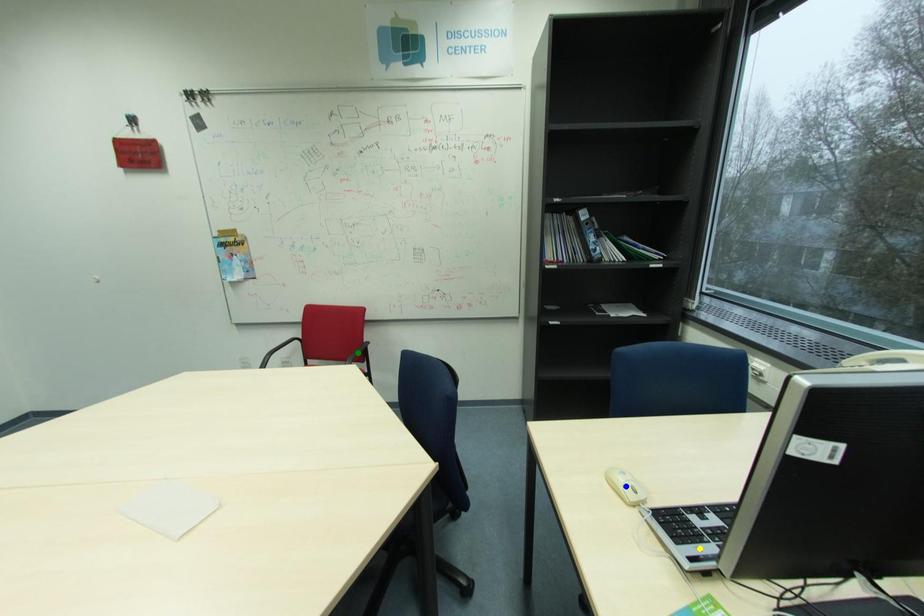
Order these from nearest to farthest:
green point
yellow point
blue point

yellow point
blue point
green point